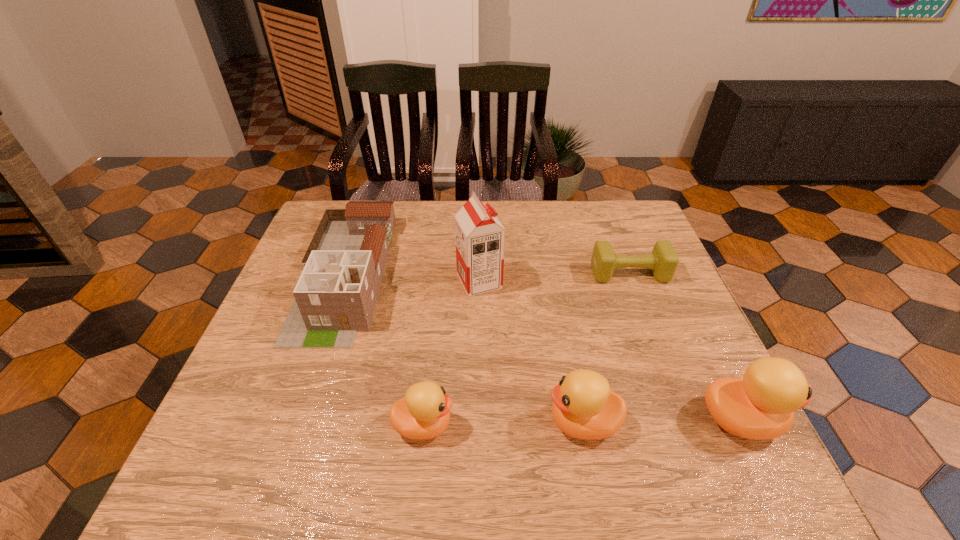
This screenshot has height=540, width=960. What are the coordinates of `the fifth tallest object` in the screenshot? It's located at pos(423,413).

The image size is (960, 540). I want to click on the leftmost duckling, so click(x=423, y=413).

Identify the location of the second duckling from right to left. The width and height of the screenshot is (960, 540). (583, 407).

The width and height of the screenshot is (960, 540). I want to click on the fourth tallest object, so click(x=583, y=407).

I want to click on the rightmost duckling, so click(x=761, y=405).

Where is `the tallest object`? The width and height of the screenshot is (960, 540). the tallest object is located at coordinates (479, 235).

This screenshot has width=960, height=540. What are the coordinates of `the leftmost object` in the screenshot? It's located at (335, 297).

Locate an element on the screen. dumbbell is located at coordinates (663, 261).

Where is `blank space located on the face of the second shortest object`? The height and width of the screenshot is (540, 960). blank space located on the face of the second shortest object is located at coordinates (573, 425).

Find the location of `vacant region located 0.400m on the face of the third object from right to left`. vacant region located 0.400m on the face of the third object from right to left is located at coordinates (349, 422).